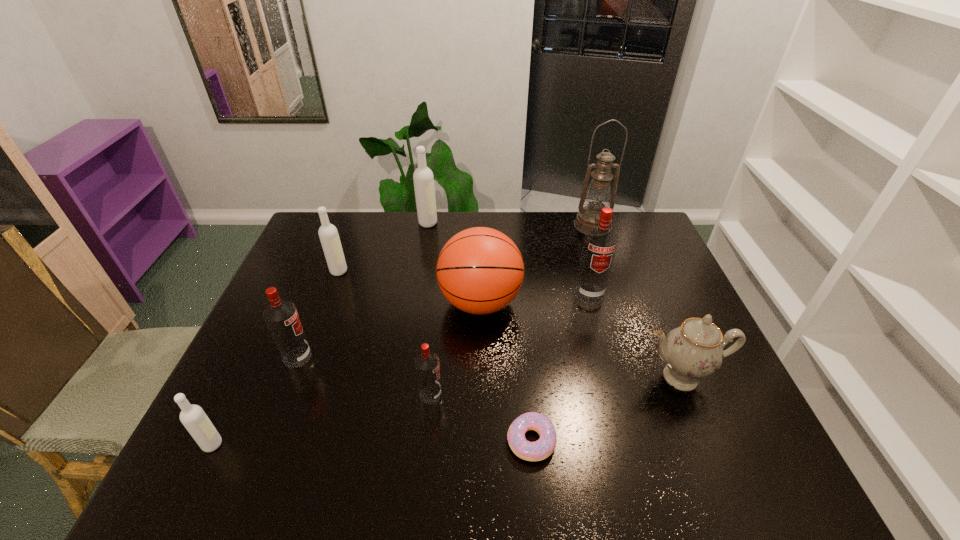
Where is `free spot that satisfies the following two spatial constraints: 1. on the front side of the doughnut; 2. on the left side of the basketball`? free spot that satisfies the following two spatial constraints: 1. on the front side of the doughnut; 2. on the left side of the basketball is located at coordinates (480, 441).

Where is `vacant region that satisfies the following two spatial constraints: 1. on the front label of the biggest red vodka; 2. on the front label of the second nearest red vodka`? This screenshot has width=960, height=540. vacant region that satisfies the following two spatial constraints: 1. on the front label of the biggest red vodka; 2. on the front label of the second nearest red vodka is located at coordinates (607, 357).